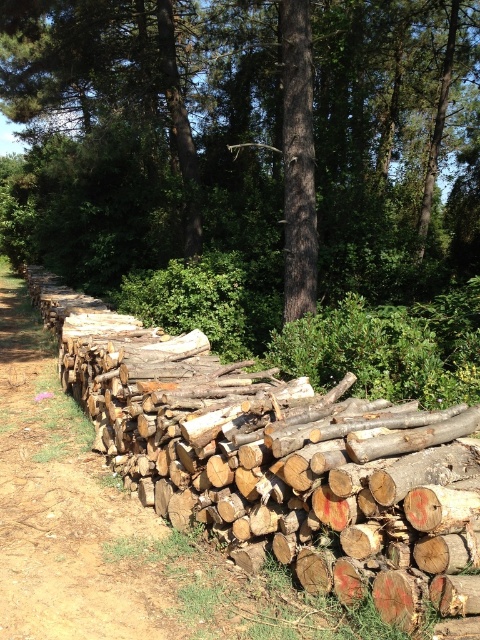
Is natural wood logs at left closer to the viewer compared to brown rough tree trunk at center?

Yes, it is.

I want to click on natural wood logs at left, so click(x=282, y=461).

Can you confirm if brown wood log at center is bigger than brown rough tree trunk at center?

Yes, brown wood log at center is bigger than brown rough tree trunk at center.

Which is in front, point (278, 140) or point (289, 196)?

Positioned in front is point (289, 196).

Image resolution: width=480 pixels, height=640 pixels. I want to click on brown wood log at center, so click(247, 141).

Between brown dirt track at lower left and brown rough tree trunk at center, which one has less height?

With less height is brown dirt track at lower left.

The height and width of the screenshot is (640, 480). In order to click on brown dirt track at lower left in this screenshot , I will do `click(72, 512)`.

Who is more distant from viewer, [192,628] or [299,134]?

The point [299,134] is behind.

I want to click on brown dirt track at lower left, so click(72, 512).